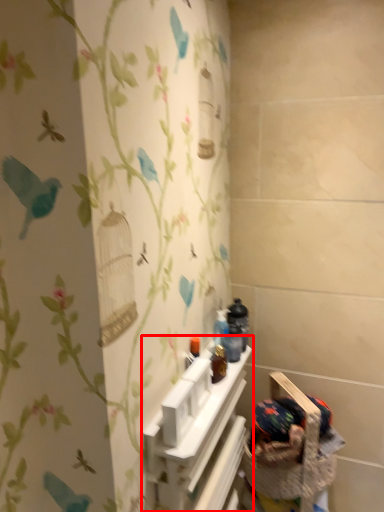
Question: Observing the image, what is the correct spatial positioning of shelf (annotated by the red box) in reference to basket container?

Choices:
 (A) right
 (B) left

Answer: (B)